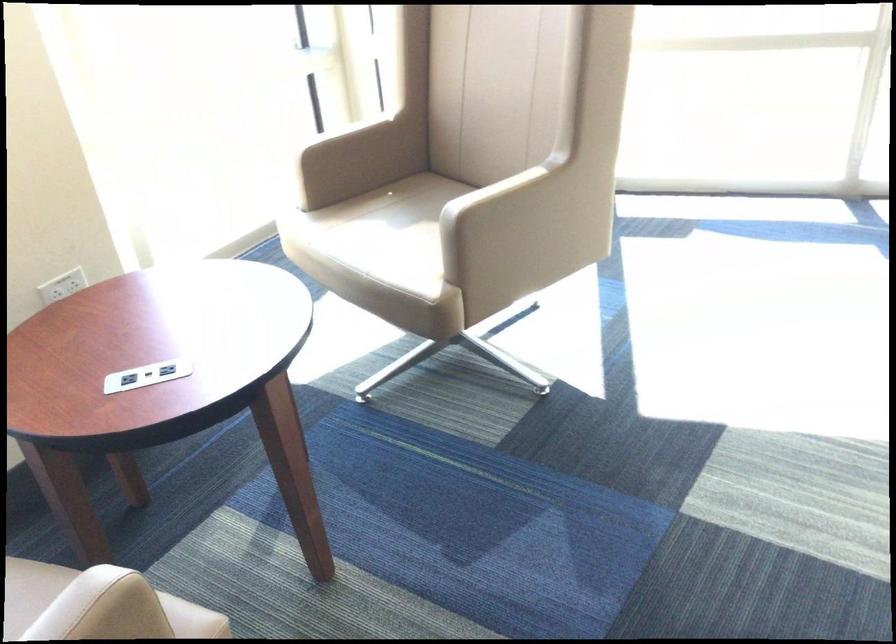
The location [62,286] corresponds to which object?

It corresponds to the wall power outlet in the image.